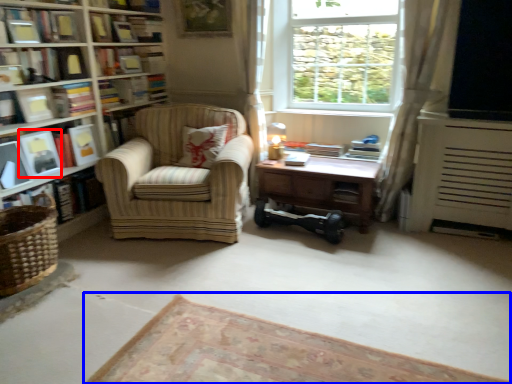
Question: Among these objects, which one is nearest to the camera, paperback book (highlighted by a red box) or plain (highlighted by a blue box)?

Choices:
 (A) paperback book
 (B) plain

Answer: (B)